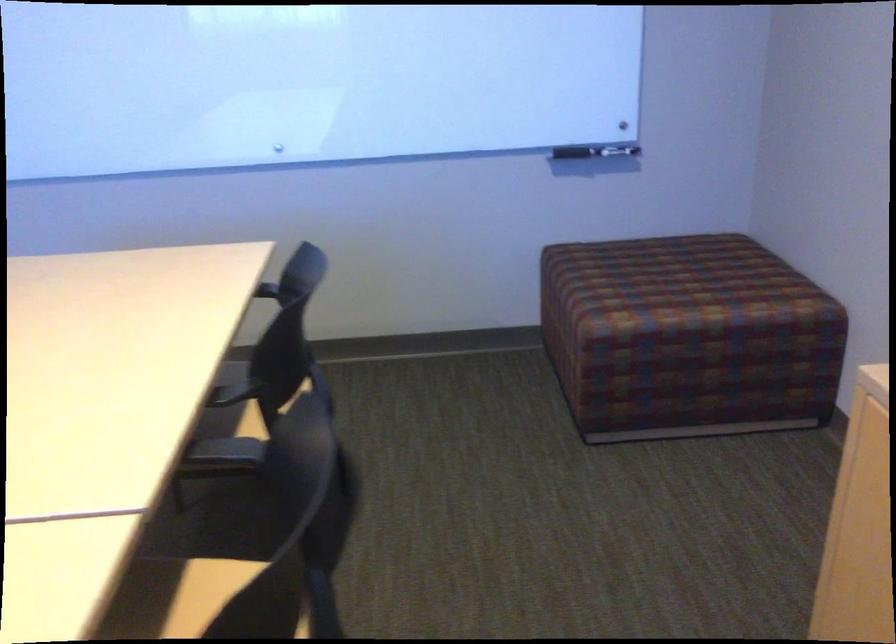
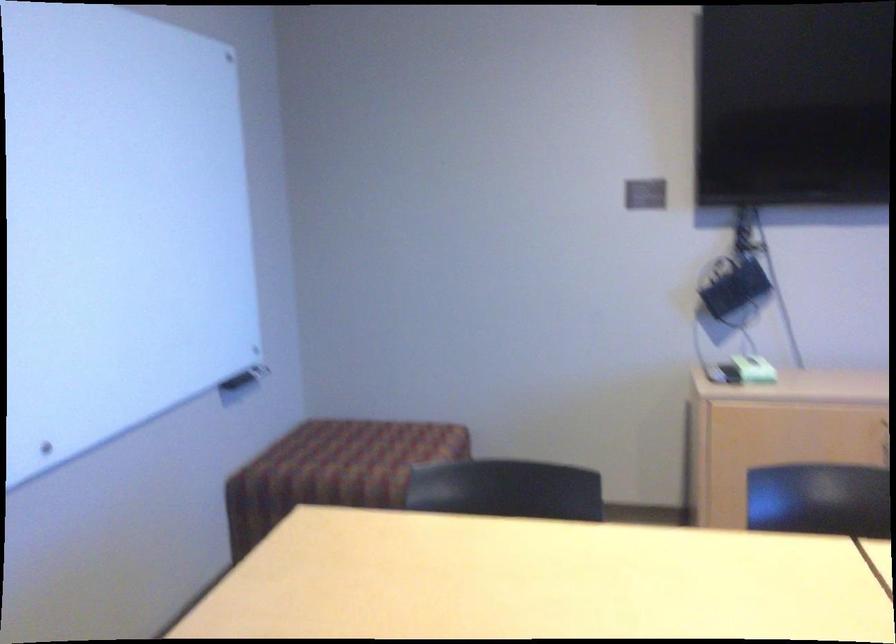
Locate, in the second image, the point that corresponds to (x=586, y=147) in the first image.

(246, 373)